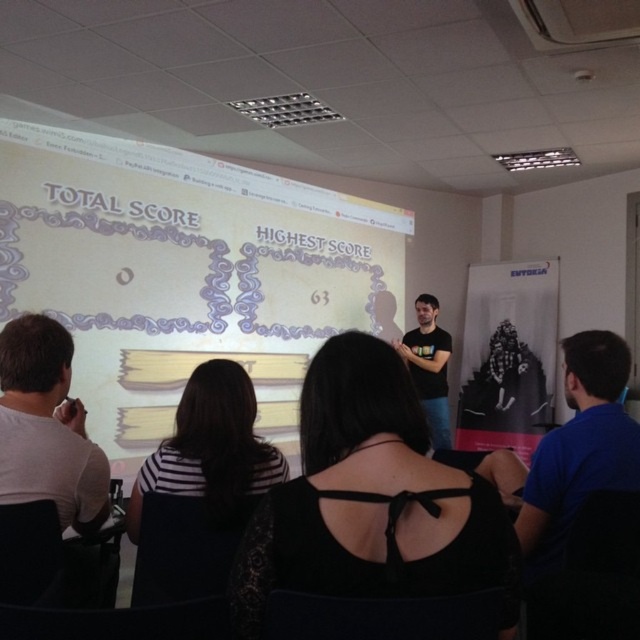
You are sitting in the classroom and want to point to the point at coordinates point (307, 444) and the point at coordinates point (410, 332). Which point is closer to you?

Point (307, 444) is in front of point (410, 332), so it is closer to you.